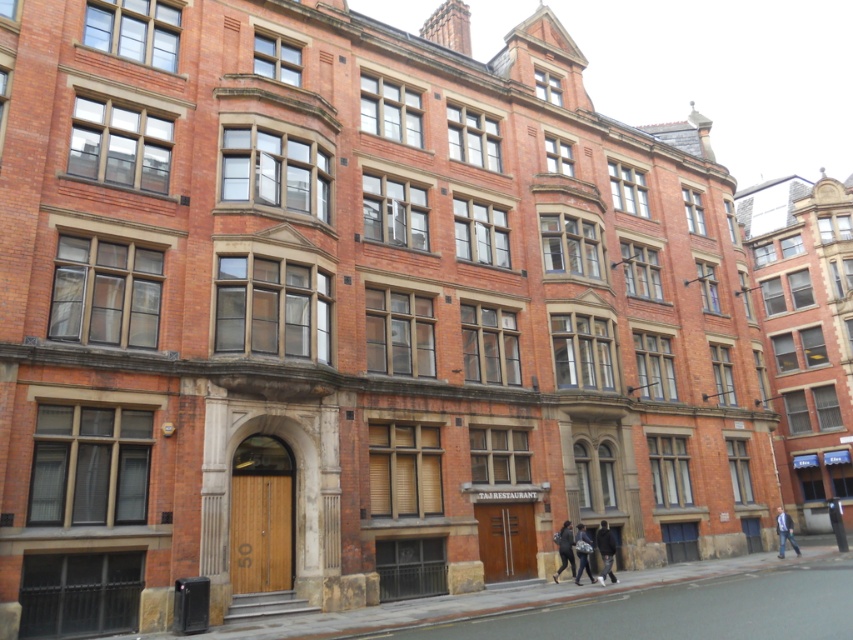
Question: Is blue denim jacket at lower right thinner than dark gray fabric jacket at lower center?

Choices:
 (A) no
 (B) yes

Answer: (A)

Question: Is dark gray fabric jacket at center further to the viewer compared to blue denim jacket at lower right?

Choices:
 (A) no
 (B) yes

Answer: (A)

Question: Does dark gray fabric jacket at center have a smaller size compared to blue denim jacket at lower right?

Choices:
 (A) yes
 (B) no

Answer: (A)

Question: Which of the following is the farthest from the observer?

Choices:
 (A) (x=569, y=531)
 (B) (x=781, y=545)
 (C) (x=602, y=568)

Answer: (B)

Question: Among these points, which one is farthest from the camera?

Choices:
 (A) (596, 547)
 (B) (782, 536)
 (C) (577, 572)
 (D) (569, 561)

Answer: (B)

Question: Which of the following is the farthest from the observer?

Choices:
 (A) dark gray fabric jacket at lower right
 (B) dark gray fabric jacket at center

Answer: (B)